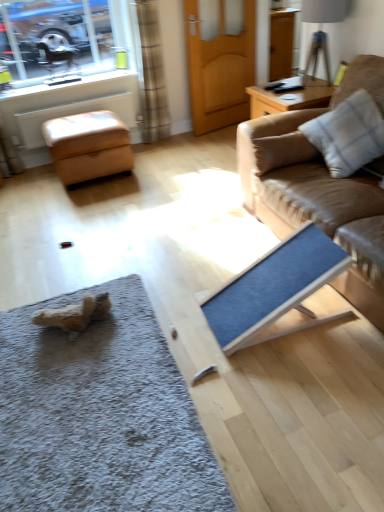
Question: Is brown textured curtain at upper left completely or partially outside of matte brown armchair at upper left?

Choices:
 (A) yes
 (B) no

Answer: (A)

Question: From a real-world perspective, is brown textured curtain at upper left beneath matte brown armchair at upper left?

Choices:
 (A) yes
 (B) no

Answer: (A)

Question: Is matte brown armchair at upper left at the back of brown textured curtain at upper left?

Choices:
 (A) yes
 (B) no

Answer: (B)

Question: From a real-world perspective, is brown textured curtain at upper left physically above matte brown armchair at upper left?

Choices:
 (A) yes
 (B) no

Answer: (B)

Question: Is brown textured curtain at upper left further to the viewer compared to matte brown armchair at upper left?

Choices:
 (A) no
 (B) yes

Answer: (A)

Question: From a real-world perspective, is brown textured curtain at upper left positioned above or below white checkered fabric pillow on the right?

Choices:
 (A) above
 (B) below

Answer: (B)

Question: Considering the positions of brown textured curtain at upper left and white checkered fabric pillow on the right in the image, is brown textured curtain at upper left bigger or smaller than white checkered fabric pillow on the right?

Choices:
 (A) big
 (B) small

Answer: (A)

Question: From the image's perspective, is brown textured curtain at upper left located above or below white checkered fabric pillow on the right?

Choices:
 (A) above
 (B) below

Answer: (A)

Question: Looking at their shapes, would you say brown textured curtain at upper left is wider or thinner than white checkered fabric pillow on the right?

Choices:
 (A) thin
 (B) wide

Answer: (A)

Question: From the image's perspective, is wooden door at center located above or below matte brown armchair at upper left?

Choices:
 (A) below
 (B) above

Answer: (B)

Question: From a real-world perspective, relative to matte brown armchair at upper left, is wooden door at center vertically above or below?

Choices:
 (A) above
 (B) below

Answer: (B)

Question: In terms of height, does wooden door at center look taller or shorter compared to matte brown armchair at upper left?

Choices:
 (A) tall
 (B) short

Answer: (A)

Question: Is wooden door at center bigger or smaller than matte brown armchair at upper left?

Choices:
 (A) small
 (B) big

Answer: (B)

Question: Based on their sizes in the image, would you say gray shaggy doormat at lower left is bigger or smaller than clear glass window at upper left?

Choices:
 (A) big
 (B) small

Answer: (B)

Question: From a real-world perspective, is gray shaggy doormat at lower left physically located above or below clear glass window at upper left?

Choices:
 (A) above
 (B) below

Answer: (B)